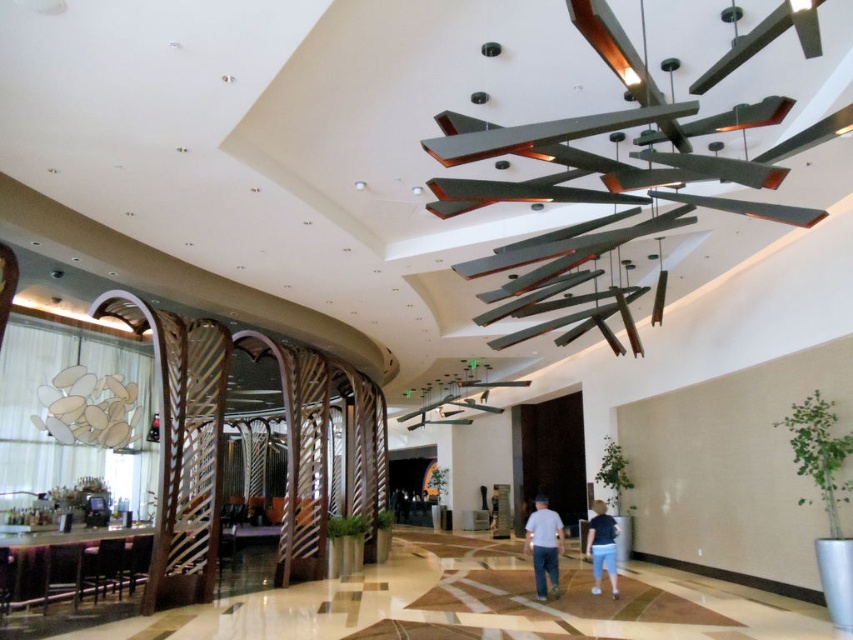
Question: Among these objects, which one is nearest to the camera?

Choices:
 (A) blue denim shorts at center
 (B) light blue shirt at center

Answer: (B)

Question: Does light blue shirt at center appear on the right side of blue denim shorts at center?

Choices:
 (A) no
 (B) yes

Answer: (A)

Question: Does light blue shirt at center lie in front of blue denim shorts at center?

Choices:
 (A) no
 (B) yes

Answer: (B)

Question: Can you confirm if light blue shirt at center is bigger than blue denim shorts at center?

Choices:
 (A) no
 (B) yes

Answer: (A)

Question: Which point is farther to the camera?

Choices:
 (A) light blue shirt at center
 (B) blue denim shorts at center

Answer: (B)